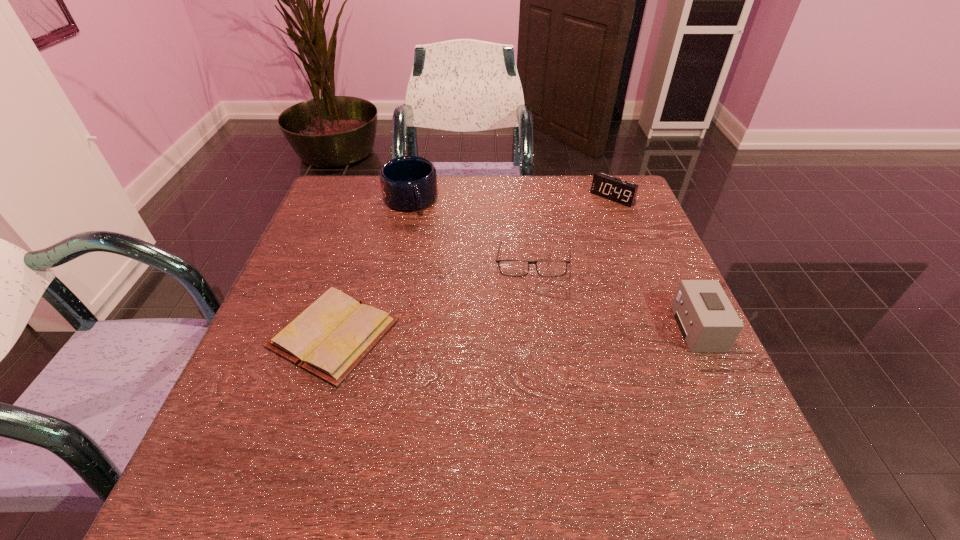
Find the location of a particular element. The width and height of the screenshot is (960, 540). free space on the desktop that is between the diary and the nearer alarm clock and is positioned with the handle on the side of the mug is located at coordinates (x=475, y=332).

Identify the location of free spot on the desktop that is between the shortest object and the nearer alarm clock and is positioned on the front-facing side of the shorter alarm clock. (477, 332).

Image resolution: width=960 pixels, height=540 pixels. I want to click on vacant space on the desktop that is between the diary and the nearer alarm clock and is positioned with the lenses facing outward on the third object from left to right, so click(x=468, y=332).